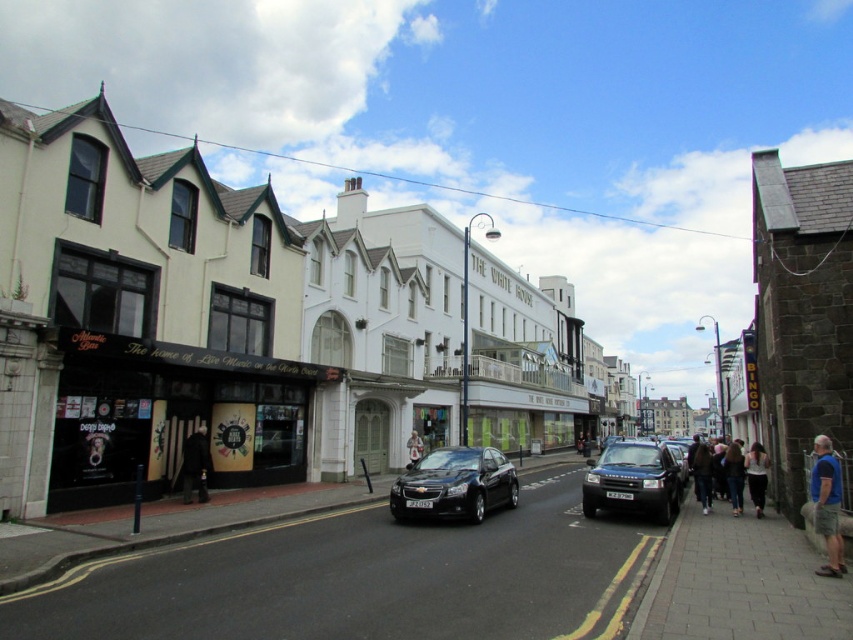
You are a delivery person standing at the point marked as point (734, 476). You need to deliver a package to the Atlantic Bar on the left side. Is the Atlantic Bar on the left side visible from your current position?

The point (734, 476) is on jeans at lower right. Since the Atlantic Bar is on the left side of the street, it should be visible from the lower right position unless there are obstructions not mentioned in the scene description.

You are a fashion designer observing the street scene. You notice a black matte coat at center and a white cotton shirt at center. Which clothing item appears bigger in size?

The black matte coat at center has a larger size compared to the white cotton shirt at center, so the black matte coat at center appears bigger in size.

You are a customer at the Atlantic Bar and you want to wear both the jeans at lower right and the white cotton shirt at center. However, you have a limited space in your bag. Which item takes up more space in your bag?

The jeans at lower right takes up more space in your bag because its width is larger than the white cotton shirt at center.